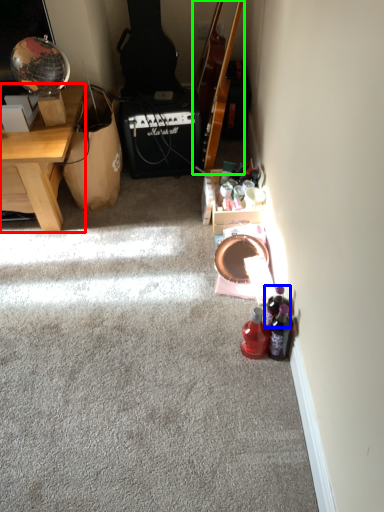
Question: Considering the real-world distances, which object is closest to desk (highlighted by a red box)? bottle (highlighted by a blue box) or guitar (highlighted by a green box).

Choices:
 (A) bottle
 (B) guitar

Answer: (B)